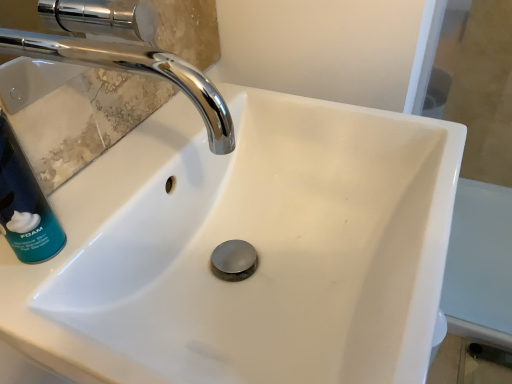
Question: Considering their positions, is chrome/metallic faucet at upper left located in front of or behind teal matte shaving cream can at left?

Choices:
 (A) front
 (B) behind

Answer: (A)

Question: In terms of size, does chrome/metallic faucet at upper left appear bigger or smaller than teal matte shaving cream can at left?

Choices:
 (A) small
 (B) big

Answer: (B)

Question: Is chrome/metallic faucet at upper left inside the boundaries of teal matte shaving cream can at left, or outside?

Choices:
 (A) inside
 (B) outside

Answer: (B)

Question: Based on their sizes in the image, would you say teal matte shaving cream can at left is bigger or smaller than chrome/metallic faucet at upper left?

Choices:
 (A) big
 (B) small

Answer: (B)

Question: Visually, is teal matte shaving cream can at left positioned to the left or to the right of chrome/metallic faucet at upper left?

Choices:
 (A) left
 (B) right

Answer: (A)

Question: Considering the positions of teal matte shaving cream can at left and chrome/metallic faucet at upper left in the image, is teal matte shaving cream can at left wider or thinner than chrome/metallic faucet at upper left?

Choices:
 (A) wide
 (B) thin

Answer: (B)

Question: From the image's perspective, is teal matte shaving cream can at left above or below chrome/metallic faucet at upper left?

Choices:
 (A) above
 (B) below

Answer: (B)